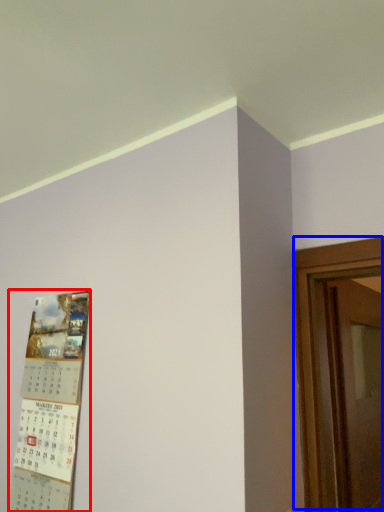
Question: Which object is closer to the camera taking this photo, poster (highlighted by a red box) or door (highlighted by a blue box)?

Choices:
 (A) poster
 (B) door

Answer: (A)